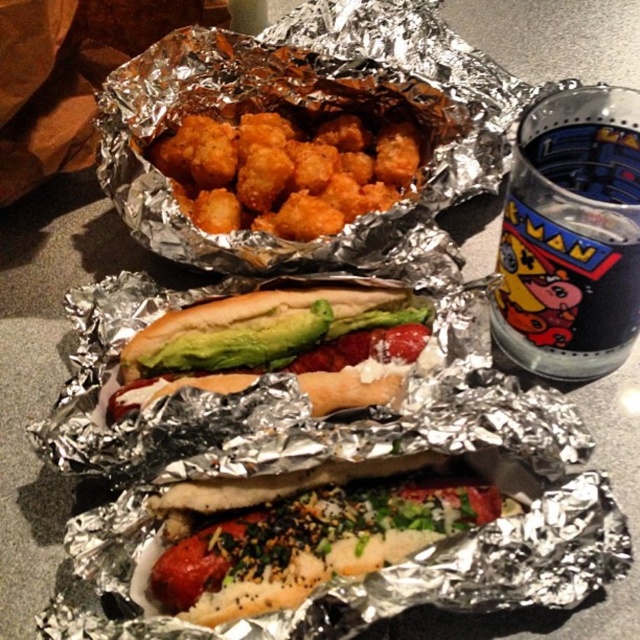
Question: Among these points, which one is nearest to the camera?

Choices:
 (A) (300, 596)
 (B) (298, 349)
 (C) (381, 170)

Answer: (A)

Question: Estimate the real-world distances between objects in this image. Which object is closer to the sesame seed bun hot dog at center?

Choices:
 (A) golden crispy tater tots at center
 (B) green avocado hot dog at center

Answer: (B)

Question: Is green avocado hot dog at center to the right of golden crispy tater tots at center from the viewer's perspective?

Choices:
 (A) yes
 (B) no

Answer: (A)

Question: Can you confirm if sesame seed bun hot dog at center is bigger than green avocado hot dog at center?

Choices:
 (A) yes
 (B) no

Answer: (B)

Question: Does green avocado hot dog at center appear under golden crispy tater tots at center?

Choices:
 (A) no
 (B) yes

Answer: (B)

Question: Based on their relative distances, which object is nearer to the green avocado hot dog at center?

Choices:
 (A) golden crispy tater tots at center
 (B) sesame seed bun hot dog at center

Answer: (B)